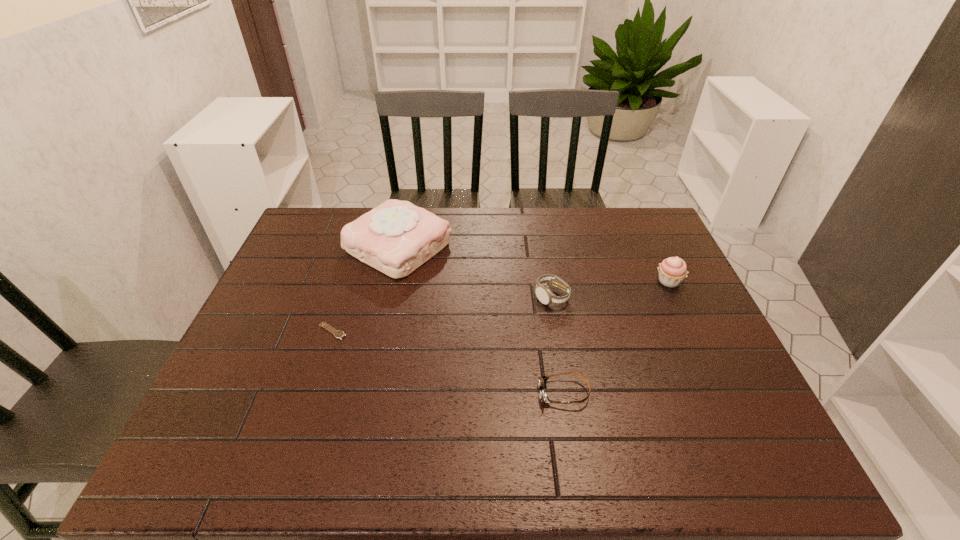
In the image, there is a desktop. At what (x,y) coordinates should I click in order to perform the action: click on vacant space at the left edge. Please return your answer as a coordinate pair (x, y). This screenshot has width=960, height=540. Looking at the image, I should click on (293, 371).

What are the coordinates of `vacant space at the right edge` in the screenshot? It's located at (746, 396).

Where is `vacant space at the far left corner of the desktop`? This screenshot has height=540, width=960. vacant space at the far left corner of the desktop is located at coordinates [x=299, y=241].

Find the location of a particular element. The image size is (960, 540). free point between the right watch and the shortest object is located at coordinates (442, 314).

The image size is (960, 540). I want to click on free spot between the fourth tallest object and the right watch, so click(558, 345).

Where is `free space between the nearer watch and the rightmost object`? free space between the nearer watch and the rightmost object is located at coordinates (500, 306).

At what (x,y) coordinates should I click in order to perform the action: click on unoccupied area between the goggles and the cake. Please return your answer as a coordinate pair (x, y). Image resolution: width=960 pixels, height=540 pixels. Looking at the image, I should click on (481, 320).

Locate an element on the screen. This screenshot has width=960, height=540. vacant area that lies between the tallest object and the left watch is located at coordinates (366, 289).

Find the location of a particular element. The height and width of the screenshot is (540, 960). empty location between the cupcake and the third tallest object is located at coordinates (610, 289).

You are a GUI agent. You are given a task and a screenshot of the screen. Output one action in this format:
    pyautogui.click(x=<x>, y=<y>)
    Task: Click on the vacant point located between the cake and the fourth tallest object
    
    Given the screenshot: What is the action you would take?
    pyautogui.click(x=481, y=320)